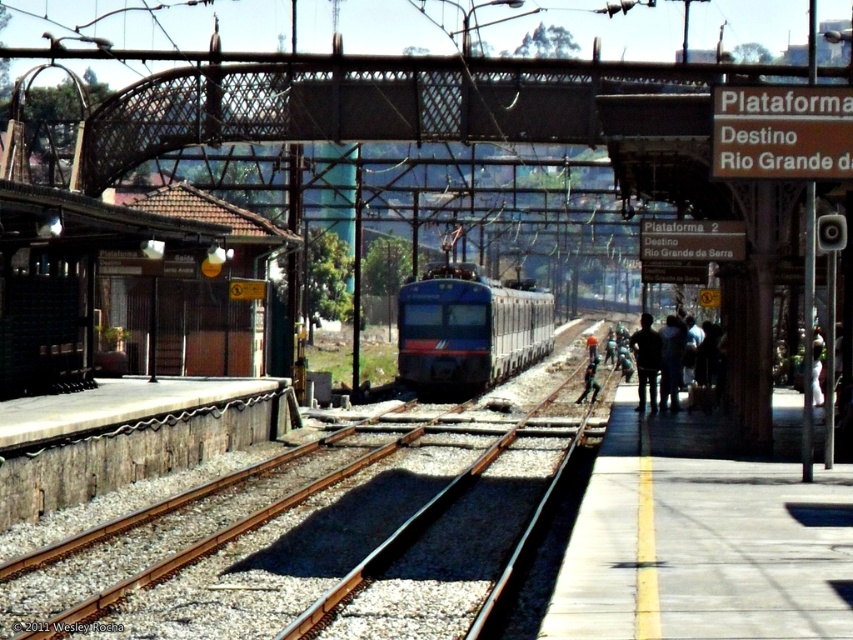
You are standing on the platform at the train station. You want to find the smooth metal track at center. Where should you look relative to your position?

You should look towards the center of the platform, specifically at the coordinates point (328, 532), to find the smooth metal track at center.

You are a train conductor approaching the station. You need to ensure the train aligns properly with the platform. Given the sizes of the smooth metal track at center and the concrete platform at right, which one should you focus on for alignment?

The smooth metal track at center is larger in size than the concrete platform at right, so you should focus on aligning the train with the smooth metal track at center to ensure proper positioning.

You are a passenger waiting on the platform and need to board the train. The train is approaching from the left. You see the smooth metal track at center and the dark blue fabric at right. Which object is closer to the incoming train as it arrives?

The smooth metal track at center is closer to the incoming train as it arrives because it is positioned to the left of the dark blue fabric at right, and the train is approaching from the left side.